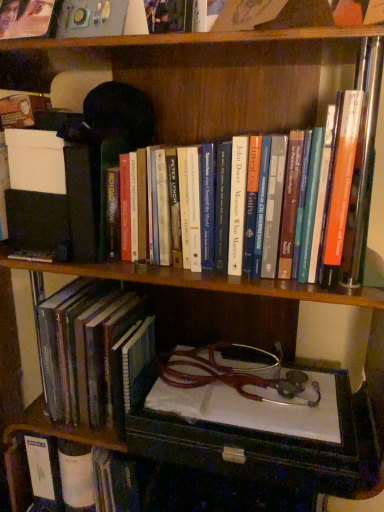
What do you see at coordinates (90, 355) in the screenshot?
I see `hardcover book at lower left, which is the 2th book from top to bottom` at bounding box center [90, 355].

What do you see at coordinates (101, 481) in the screenshot? Image resolution: width=384 pixels, height=512 pixels. I see `hardcover book at lower left, acting as the 3th book starting from the top` at bounding box center [101, 481].

Locate an element on the screen. The width and height of the screenshot is (384, 512). hardcover book at lower left, the 2th book from the bottom is located at coordinates (90, 355).

From the image's perspective, who appears lower, hardcover book at lower left, acting as the 3th book starting from the top, or hardcover book at lower left, the 2th book from the bottom?

From the image's view, hardcover book at lower left, acting as the 3th book starting from the top, is below.

Between hardcover book at lower left, acting as the 1th book starting from the bottom, and hardcover book at lower left, the 2th book from the bottom, which one is positioned in front?

Positioned in front is hardcover book at lower left, the 2th book from the bottom.

Considering the positions of point (105, 488) and point (57, 355), is point (105, 488) closer or farther from the camera than point (57, 355)?

Clearly, point (105, 488) is more distant from the camera than point (57, 355).

Considering the points (47, 346) and (250, 126), which point is behind, point (47, 346) or point (250, 126)?

Positioned behind is point (250, 126).

From the picture: Does hardcover book at lower left, the 2th book from the bottom, have a greater width compared to hardcover books at center, the first book when ordered from top to bottom?

Indeed, hardcover book at lower left, the 2th book from the bottom, has a greater width compared to hardcover books at center, the first book when ordered from top to bottom.

Between hardcover book at lower left, which is the 2th book from top to bottom, and hardcover books at center, the first book when ordered from top to bottom, which one has less height?

hardcover books at center, the first book when ordered from top to bottom.

Can you tell me how much hardcover book at lower left, the 2th book from the bottom, and hardcover books at center, which is the third book from bottom to top, differ in facing direction?

hardcover book at lower left, the 2th book from the bottom, and hardcover books at center, which is the third book from bottom to top, are facing 5.25 degrees away from each other.

Which point is more distant from viewer, (349,80) or (111,509)?

Point (111,509)

Which of these two, hardcover books at center, the first book when ordered from top to bottom, or hardcover book at lower left, acting as the 1th book starting from the bottom, is thinner?

With smaller width is hardcover books at center, the first book when ordered from top to bottom.

Would you say hardcover books at center, the first book when ordered from top to bottom, is inside or outside hardcover book at lower left, acting as the 1th book starting from the bottom?

hardcover books at center, the first book when ordered from top to bottom, is spatially situated outside hardcover book at lower left, acting as the 1th book starting from the bottom.

Identify the location of the 2nd book positioned below the hardcover books at center, the first book when ordered from top to bottom (from the image's perspective). (101, 481).

Which is in front, point (106, 452) or point (194, 79)?

The point (194, 79) is closer to the camera.

Between hardcover book at lower left, acting as the 1th book starting from the bottom, and hardcover books at center, which is the third book from bottom to top, which one has smaller size?

With smaller size is hardcover book at lower left, acting as the 1th book starting from the bottom.

Between hardcover book at lower left, acting as the 3th book starting from the top, and hardcover books at center, which is the third book from bottom to top, which one has smaller width?

hardcover books at center, which is the third book from bottom to top, is thinner.

Is hardcover books at center, the first book when ordered from top to bottom, surrounding hardcover book at lower left, the 2th book from the bottom?

No, hardcover book at lower left, the 2th book from the bottom, is located outside of hardcover books at center, the first book when ordered from top to bottom.

Which is behind, point (376, 174) or point (72, 338)?

The point (72, 338) is farther from the camera.

In the scene shown: From the image's perspective, is hardcover books at center, the first book when ordered from top to bottom, beneath hardcover book at lower left, which is the 2th book from top to bottom?

Incorrect, from the image's perspective, hardcover books at center, the first book when ordered from top to bottom, is higher than hardcover book at lower left, which is the 2th book from top to bottom.

From the picture: Is hardcover books at center, which is the third book from bottom to top, oriented towards hardcover book at lower left, which is the 2th book from top to bottom?

No.

Considering the relative positions of hardcover book at lower left, which is the 2th book from top to bottom, and hardcover book at lower left, acting as the 1th book starting from the bottom, in the image provided, is hardcover book at lower left, which is the 2th book from top to bottom, to the left or to the right of hardcover book at lower left, acting as the 1th book starting from the bottom,?

hardcover book at lower left, which is the 2th book from top to bottom, is to the right of hardcover book at lower left, acting as the 1th book starting from the bottom.

How many degrees apart are the facing directions of hardcover book at lower left, which is the 2th book from top to bottom, and hardcover book at lower left, acting as the 3th book starting from the top?

The angle between the facing direction of hardcover book at lower left, which is the 2th book from top to bottom, and the facing direction of hardcover book at lower left, acting as the 3th book starting from the top, is 4.95 degrees.

The height and width of the screenshot is (512, 384). Find the location of `the 1st book positioned above the hardcover book at lower left, acting as the 3th book starting from the top (from the image's perspective)`. the 1st book positioned above the hardcover book at lower left, acting as the 3th book starting from the top (from the image's perspective) is located at coordinates (90, 355).

Considering the points (42, 343) and (138, 488), which point is behind, point (42, 343) or point (138, 488)?

The point (138, 488) is farther from the camera.

I want to click on book below the hardcover book at lower left, which is the 2th book from top to bottom (from the image's perspective), so click(101, 481).

Image resolution: width=384 pixels, height=512 pixels. I want to click on book located above the hardcover book at lower left, which is the 2th book from top to bottom (from a real-world perspective), so click(x=221, y=77).

Which object lies further to the anchor point hardcover book at lower left, which is the 2th book from top to bottom, hardcover book at lower left, acting as the 1th book starting from the bottom, or hardcover books at center, the first book when ordered from top to bottom?

Among the two, hardcover books at center, the first book when ordered from top to bottom, is located further to hardcover book at lower left, which is the 2th book from top to bottom.

Estimate the real-world distances between objects in this image. Which object is further from hardcover book at lower left, acting as the 3th book starting from the top, hardcover books at center, the first book when ordered from top to bottom, or hardcover book at lower left, the 2th book from the bottom?

hardcover books at center, the first book when ordered from top to bottom, is further to hardcover book at lower left, acting as the 3th book starting from the top.

Estimate the real-world distances between objects in this image. Which object is closer to hardcover book at lower left, the 2th book from the bottom, hardcover books at center, which is the third book from bottom to top, or hardcover book at lower left, acting as the 1th book starting from the bottom?

hardcover book at lower left, acting as the 1th book starting from the bottom, is positioned closer to the anchor hardcover book at lower left, the 2th book from the bottom.

From the image, which object appears to be farther from hardcover books at center, which is the third book from bottom to top, hardcover book at lower left, acting as the 3th book starting from the top, or hardcover book at lower left, the 2th book from the bottom?

hardcover book at lower left, acting as the 3th book starting from the top, is positioned further to the anchor hardcover books at center, which is the third book from bottom to top.

When comparing their distances from hardcover book at lower left, acting as the 1th book starting from the bottom, does hardcover book at lower left, which is the 2th book from top to bottom, or hardcover books at center, which is the third book from bottom to top, seem further?

Among the two, hardcover books at center, which is the third book from bottom to top, is located further to hardcover book at lower left, acting as the 1th book starting from the bottom.

Looking at the image, which one is located further to hardcover books at center, which is the third book from bottom to top, hardcover book at lower left, the 2th book from the bottom, or hardcover book at lower left, acting as the 3th book starting from the top?

hardcover book at lower left, acting as the 3th book starting from the top, is positioned further to the anchor hardcover books at center, which is the third book from bottom to top.

Find the location of `book between hardcover books at center, the first book when ordered from top to bottom, and hardcover book at lower left, acting as the 3th book starting from the top, in the up-down direction`. book between hardcover books at center, the first book when ordered from top to bottom, and hardcover book at lower left, acting as the 3th book starting from the top, in the up-down direction is located at coordinates (90, 355).